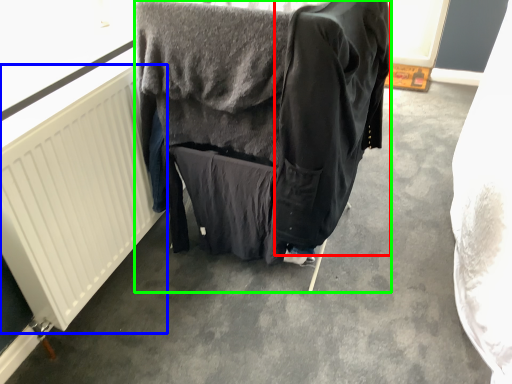
Question: Considering the real-world distances, which object is closest to clothing (highlighted by a red box)? radiator (highlighted by a blue box) or furniture (highlighted by a green box).

Choices:
 (A) radiator
 (B) furniture

Answer: (B)